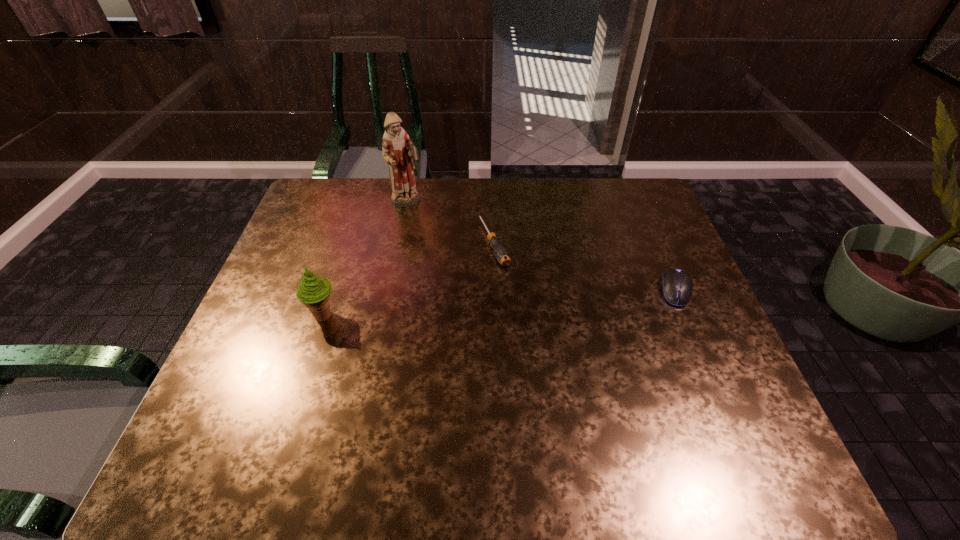
You are a GUI agent. You are given a task and a screenshot of the screen. Output one action in this format:
    pyautogui.click(x=<x>, y=<y>)
    Task: Click on the empty space between the second object from right to left and the third object from right to left
    
    Given the screenshot: What is the action you would take?
    pyautogui.click(x=450, y=222)

What are the coordinates of `free space between the second tallest object and the computer mouse` in the screenshot? It's located at (499, 303).

You are a GUI agent. You are given a task and a screenshot of the screen. Output one action in this format:
    pyautogui.click(x=<x>, y=<y>)
    Task: Click on the free point between the third shortest object and the third nearest object
    The image size is (960, 540).
    Given the screenshot: What is the action you would take?
    tap(408, 279)

Locate an element on the screen. This screenshot has height=540, width=960. vacant area that lies between the screwdriver and the rightmost object is located at coordinates (585, 266).

Find the location of a particular element. Image resolution: width=960 pixels, height=540 pixels. free point between the farthest object and the rightmost object is located at coordinates (541, 246).

Find the location of a particular element. The height and width of the screenshot is (540, 960). vacant space that is in between the rightmost object and the leftmost object is located at coordinates (499, 303).

Where is `object identified as the third closest to the figurine`? This screenshot has height=540, width=960. object identified as the third closest to the figurine is located at coordinates (677, 286).

The width and height of the screenshot is (960, 540). I want to click on object that stands as the closest to the second object from right to left, so click(x=398, y=151).

Identify the location of free space that satisfies the following two spatial constraints: 1. on the front side of the second object from right to left; 2. on the left side of the computer mouse. Image resolution: width=960 pixels, height=540 pixels. (494, 291).

Find the location of a particular element. vacant space that satisfies the following two spatial constraints: 1. on the back side of the leftmost object; 2. on the left side of the rightmost object is located at coordinates (332, 291).